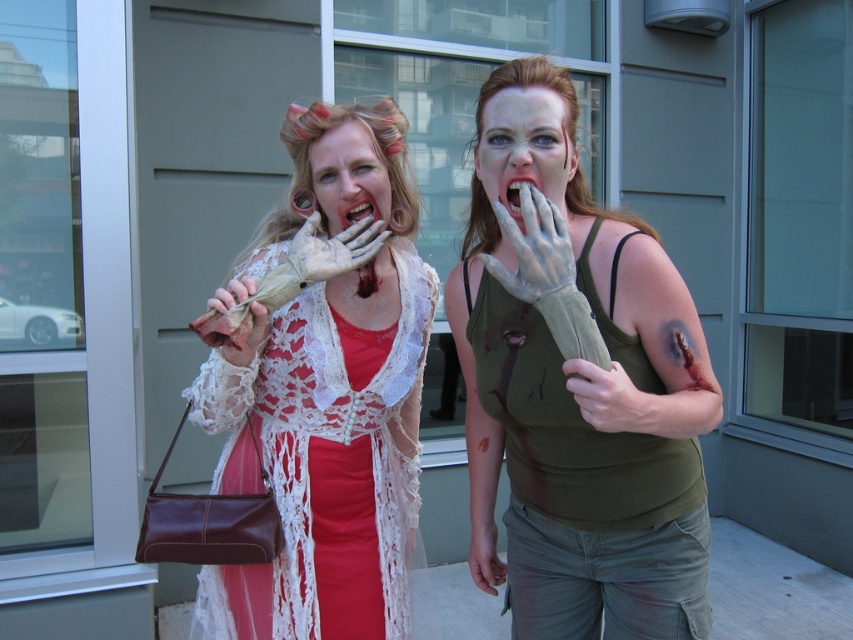
Is point (511, 180) closer to camera compared to point (630, 428)?

No, it is not.

Describe the element at coordinates (524, 147) in the screenshot. I see `matte gray face at center` at that location.

You are a GUI agent. You are given a task and a screenshot of the screen. Output one action in this format:
    pyautogui.click(x=<x>, y=<y>)
    Task: Click on the matte gray face at center
    
    Given the screenshot: What is the action you would take?
    pyautogui.click(x=524, y=147)

Does matte lace dress at center have a greater width compared to matte gray face at center?

Correct, the width of matte lace dress at center exceeds that of matte gray face at center.

Can you confirm if matte lace dress at center is bigger than matte gray face at center?

Yes, matte lace dress at center is bigger than matte gray face at center.

Find the location of a particular element. The width and height of the screenshot is (853, 640). matte lace dress at center is located at coordinates (331, 397).

Consider the image. Does matte green tank top at center appear over matte white glove at center?

Incorrect, matte green tank top at center is not positioned above matte white glove at center.

Can you confirm if matte green tank top at center is positioned to the left of matte white glove at center?

In fact, matte green tank top at center is to the right of matte white glove at center.

Is point (561, 115) positioned in front of point (254, 332)?

Yes, point (561, 115) is closer to viewer.

Where is `matte green tank top at center`? The image size is (853, 640). matte green tank top at center is located at coordinates (569, 392).